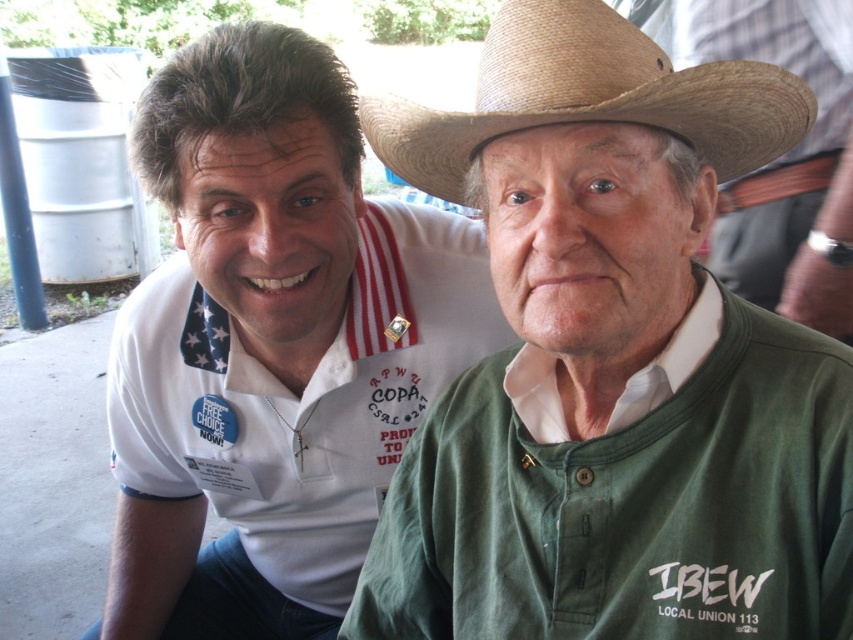
Based on the scene description, can you determine the spatial relationship between the white cotton polo shirt at left and the braided straw cowboy hat at upper center?

The white cotton polo shirt at left is located to the left of the braided straw cowboy hat at upper center.

You are a photographer trying to capture both the green cotton shirt at center and the braided straw cowboy hat at upper center in a single frame. Which object should you focus on to ensure both are fully visible?

The green cotton shirt at center is wider than the braided straw cowboy hat at upper center, so focusing on the green cotton shirt at center will ensure both objects are fully visible in the frame.